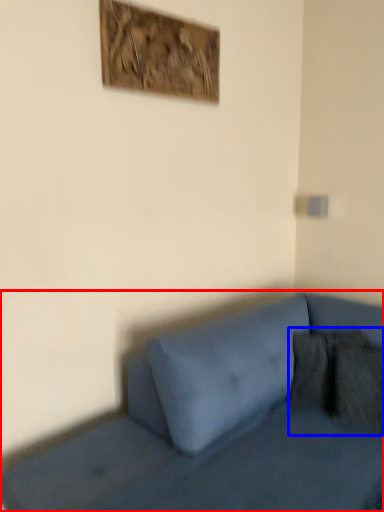
Question: Which object is closer to the camera taking this photo, studio couch (highlighted by a red box) or pillow (highlighted by a blue box)?

Choices:
 (A) studio couch
 (B) pillow

Answer: (A)